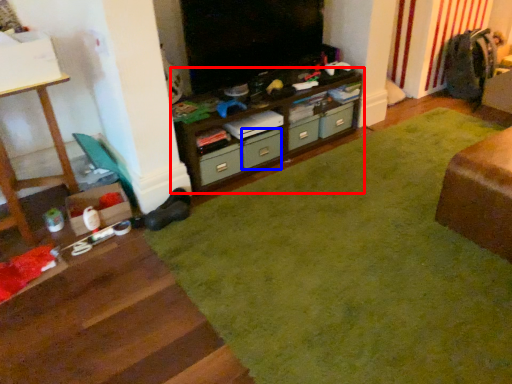
Question: Which object appears closest to the camera in this image, cabinetry (highlighted by a red box) or drawer (highlighted by a blue box)?

Choices:
 (A) cabinetry
 (B) drawer

Answer: (A)